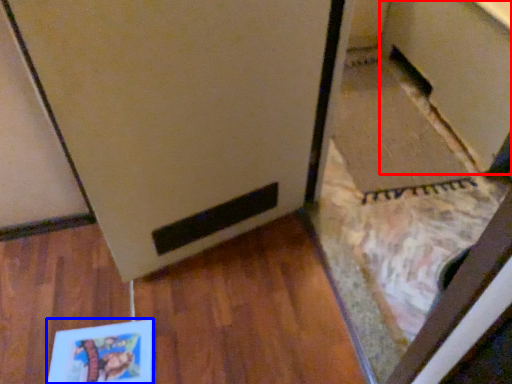
Question: Which of the following is the closest to the observer, cabinetry (highlighted by a red box) or book (highlighted by a blue box)?

Choices:
 (A) cabinetry
 (B) book

Answer: (B)